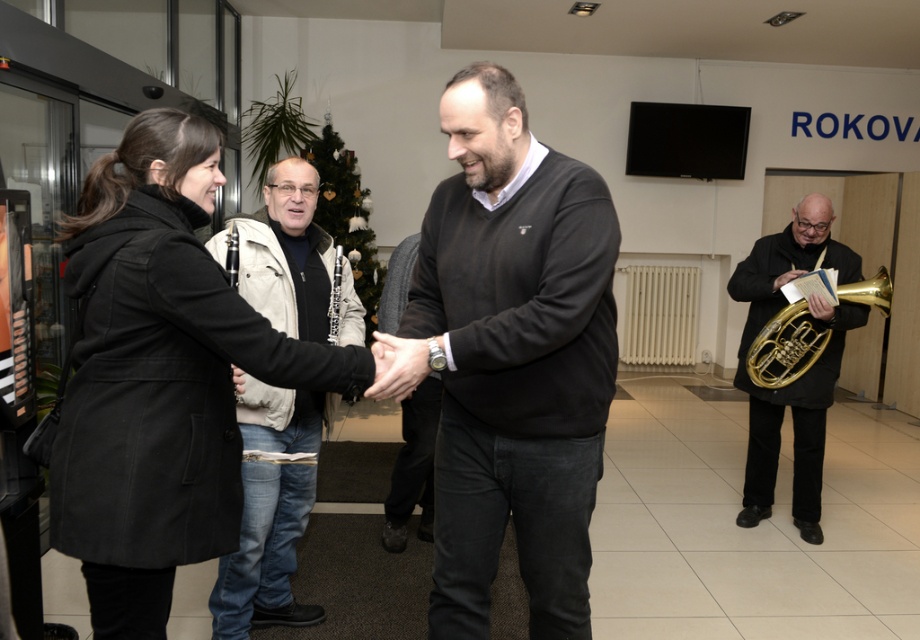
Is black matte sweater at center wider than light beige jacket at center?

Yes.

Where is `black matte sweater at center`? The width and height of the screenshot is (920, 640). black matte sweater at center is located at coordinates (512, 358).

Which is in front, point (608, 214) or point (300, 292)?

Point (608, 214) is more forward.

Locate an element on the screen. This screenshot has width=920, height=640. black matte sweater at center is located at coordinates (512, 358).

Which of these two, black wool coat at left or gold brass trumpet at right, stands shorter?

gold brass trumpet at right is shorter.

Does black wool coat at left come behind gold brass trumpet at right?

No, it is not.

Measure the distance between black wool coat at left and camera.

A distance of 4.62 feet exists between black wool coat at left and camera.

Locate an element on the screen. black wool coat at left is located at coordinates (159, 376).

Is point (487, 269) positioned in front of point (151, 602)?

No, it is behind (151, 602).

Can you confirm if black matte sweater at center is positioned to the left of black wool coat at left?

In fact, black matte sweater at center is to the right of black wool coat at left.

Measure the distance between black matte sweater at center and camera.

5.14 feet

At what (x,y) coordinates should I click in order to perform the action: click on black matte sweater at center. Please return your answer as a coordinate pair (x, y). This screenshot has height=640, width=920. Looking at the image, I should click on (512, 358).